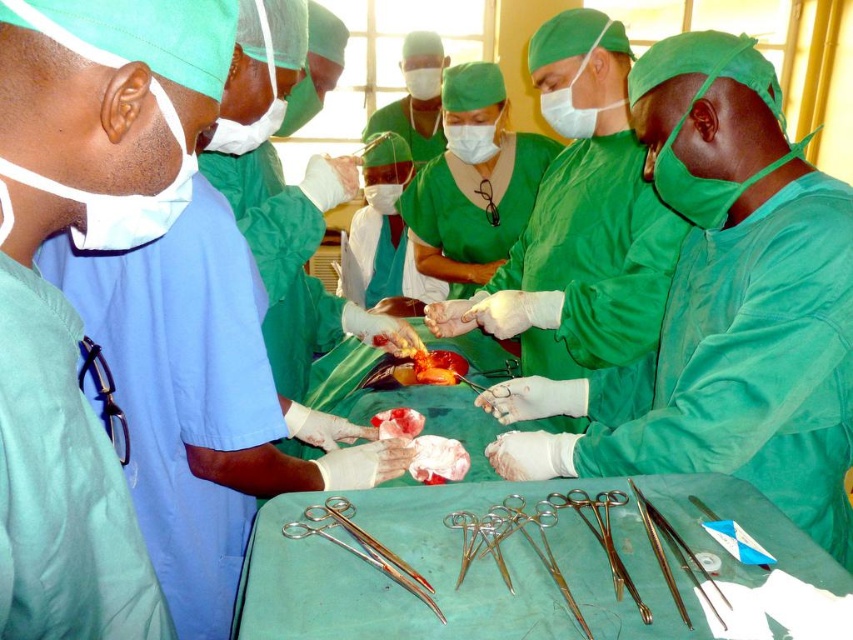
You are a medical intern who needs to choose between the surgical scissors at lower center and the satin silver forceps at lower right for a task requiring a longer tool. Which one should you select?

The satin silver forceps at lower right are longer than the surgical scissors at lower center, so you should select the satin silver forceps at lower right for the task requiring a longer tool.

You are a medical student observing a surgical procedure from the back of the operating room. The camera is positioned at your eye level. There is a point labeled as point (804, 166) in the surgical field. If you want to reach that point with a 1.2 meter long instrument, will the instrument be long enough to reach it?

The distance between point (804, 166) and the camera is 1.28 meters. Since the instrument is only 1.2 meters long, it will not be long enough to reach the point.

You are a medical student observing the surgical procedure. You need to retrieve the satin silver forceps at lower right for the surgeon. Is the forceps located in front of or behind the green matte surgical gown at center?

The satin silver forceps at lower right is behind the green matte surgical gown at center, so it is located behind the gown.